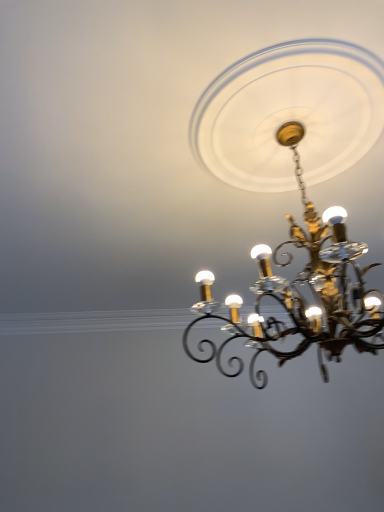
The height and width of the screenshot is (512, 384). What do you see at coordinates (299, 167) in the screenshot?
I see `black wrought iron chandelier at upper center` at bounding box center [299, 167].

Identify the location of black wrought iron chandelier at upper center. The image size is (384, 512). pos(299,167).

In order to face black wrought iron chandelier at upper center, should I rotate leftwards or rightwards?

A 15.484 degree turn to the right will do.

Identify the location of black wrought iron chandelier at upper center. The height and width of the screenshot is (512, 384). (299, 167).